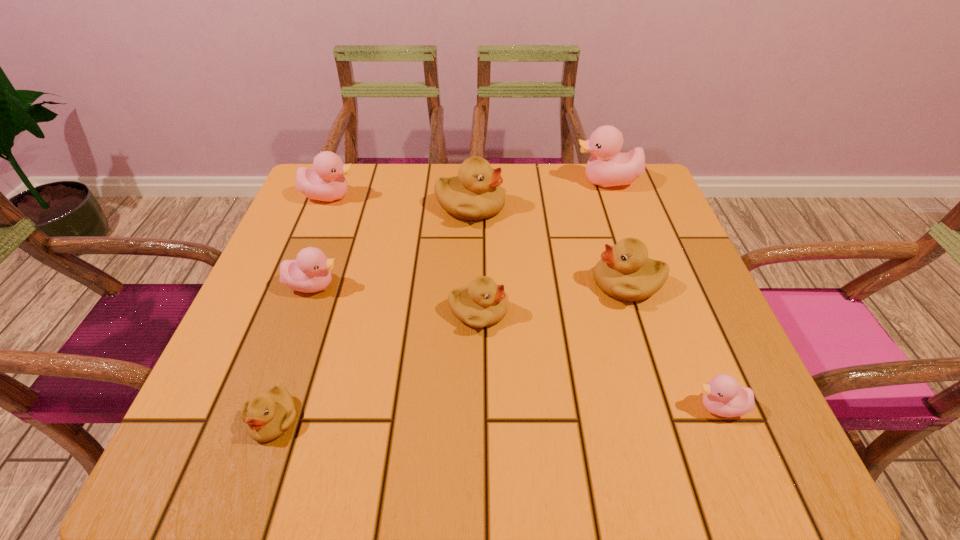
Image resolution: width=960 pixels, height=540 pixels. I want to click on vacant space situated on the front-facing side of the biggest pink duckling, so click(427, 182).

The height and width of the screenshot is (540, 960). Find the location of `blank space located 0.270m on the front-facing side of the biggest pink duckling`. blank space located 0.270m on the front-facing side of the biggest pink duckling is located at coordinates (472, 182).

The width and height of the screenshot is (960, 540). I want to click on vacant position located on the front-facing side of the biggest yellow duckling, so click(632, 207).

Identify the location of free spot located 0.400m on the front-facing side of the second biggest pink duckling. This screenshot has width=960, height=540. (515, 196).

Locate an element on the screen. The image size is (960, 540). vacant space situated 0.330m on the front-facing side of the rightmost yellow duckling is located at coordinates (435, 284).

Find the location of `free space located 0.250m on the front-facing side of the rightmost yellow duckling`. free space located 0.250m on the front-facing side of the rightmost yellow duckling is located at coordinates (473, 284).

Where is `vacant space located on the front-facing side of the rightmost yellow duckling`? vacant space located on the front-facing side of the rightmost yellow duckling is located at coordinates click(x=444, y=284).

I want to click on blank space located on the front-facing side of the second nearest pink duckling, so click(x=496, y=285).

At what (x,y) coordinates should I click in order to perform the action: click on vacant area located 0.320m on the front-facing side of the third biggest yellow duckling. Please return your answer as a coordinate pair (x, y). The width and height of the screenshot is (960, 540). Looking at the image, I should click on (669, 312).

Find the location of a particular element. Image resolution: width=960 pixels, height=540 pixels. vacant area situated on the front-facing side of the nearest pink duckling is located at coordinates (468, 407).